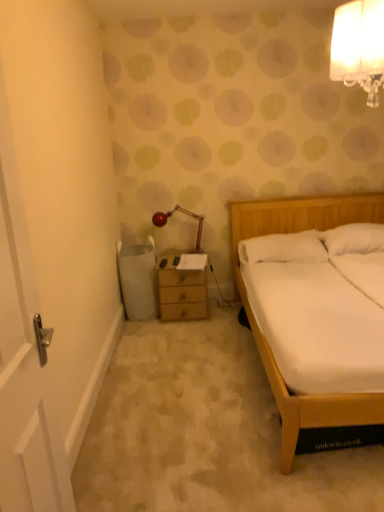
The height and width of the screenshot is (512, 384). Describe the element at coordinates (353, 238) in the screenshot. I see `white soft pillow at upper right, the 2th pillow when ordered from left to right` at that location.

What is the approximate height of white glass lampshade at upper right, which is counted as the 2th lamp, starting from the bottom?

white glass lampshade at upper right, which is counted as the 2th lamp, starting from the bottom, is 49.94 centimeters tall.

The image size is (384, 512). What are the coordinates of `white wooden door at left` in the screenshot? It's located at (52, 245).

Identify the location of wooden chest of drawers at center. This screenshot has width=384, height=512. (180, 289).

Where is `white soft pillow at upper right, arranged as the 1th pillow when viewed from the right`? This screenshot has width=384, height=512. white soft pillow at upper right, arranged as the 1th pillow when viewed from the right is located at coordinates (353, 238).

How many degrees apart are the facing directions of metallic red lamp at upper center, which is counted as the 1th lamp, starting from the back, and wooden chest of drawers at center?

A: They differ by 12.9 degrees in their facing directions.

How far apart are metallic red lamp at upper center, which is counted as the 1th lamp, starting from the back, and wooden chest of drawers at center?

metallic red lamp at upper center, which is counted as the 1th lamp, starting from the back, is 45.08 centimeters away from wooden chest of drawers at center.

Considering the sizes of objects metallic red lamp at upper center, which is counted as the 2th lamp, starting from the right, and wooden chest of drawers at center in the image provided, who is thinner, metallic red lamp at upper center, which is counted as the 2th lamp, starting from the right, or wooden chest of drawers at center?

With smaller width is metallic red lamp at upper center, which is counted as the 2th lamp, starting from the right.

From the image's perspective, between metallic red lamp at upper center, which ranks as the second lamp in front-to-back order, and wooden chest of drawers at center, which one is located above?

From the image's view, metallic red lamp at upper center, which ranks as the second lamp in front-to-back order, is above.

Does white soft pillow at right, which ranks as the second pillow in right-to-left order, have a greater height compared to wooden chest of drawers at center?

In fact, white soft pillow at right, which ranks as the second pillow in right-to-left order, may be shorter than wooden chest of drawers at center.

Is white soft pillow at right, which ranks as the second pillow in right-to-left order, oriented towards wooden chest of drawers at center?

No, white soft pillow at right, which ranks as the second pillow in right-to-left order, is not oriented towards wooden chest of drawers at center.

How distant is white soft pillow at right, marked as the 1th pillow in a left-to-right arrangement, from wooden chest of drawers at center?

A distance of 60.89 centimeters exists between white soft pillow at right, marked as the 1th pillow in a left-to-right arrangement, and wooden chest of drawers at center.

Is white soft pillow at right, which ranks as the second pillow in right-to-left order, thinner than wooden chest of drawers at center?

No.

From a real-world perspective, is white soft pillow at upper right, arranged as the 1th pillow when viewed from the right, located higher than wooden chest of drawers at center?

Yes, from a real-world perspective, white soft pillow at upper right, arranged as the 1th pillow when viewed from the right, is on top of wooden chest of drawers at center.

Are white soft pillow at upper right, the 2th pillow when ordered from left to right, and wooden chest of drawers at center far apart?

Indeed, white soft pillow at upper right, the 2th pillow when ordered from left to right, is not near wooden chest of drawers at center.

Between white soft pillow at upper right, the 2th pillow when ordered from left to right, and wooden chest of drawers at center, which one has smaller width?

With smaller width is white soft pillow at upper right, the 2th pillow when ordered from left to right.

Is white soft pillow at upper right, arranged as the 1th pillow when viewed from the right, to the left of wooden chest of drawers at center from the viewer's perspective?

Incorrect, white soft pillow at upper right, arranged as the 1th pillow when viewed from the right, is not on the left side of wooden chest of drawers at center.

From a real-world perspective, does white glass lampshade at upper right, acting as the 2th lamp starting from the left, sit lower than white plastic trash bin at left?

Incorrect, from a real-world perspective, white glass lampshade at upper right, acting as the 2th lamp starting from the left, is higher than white plastic trash bin at left.

Is white glass lampshade at upper right, acting as the 2th lamp starting from the left, smaller than white plastic trash bin at left?

Indeed, white glass lampshade at upper right, acting as the 2th lamp starting from the left, has a smaller size compared to white plastic trash bin at left.

Which of these two, white glass lampshade at upper right, marked as the second lamp in a back-to-front arrangement, or white plastic trash bin at left, stands taller?

With more height is white plastic trash bin at left.

In the scene shown: Is white soft pillow at right, which ranks as the second pillow in right-to-left order, spatially inside white plastic trash bin at left, or outside of it?

white soft pillow at right, which ranks as the second pillow in right-to-left order, is not enclosed by white plastic trash bin at left.

Could you measure the distance between white soft pillow at right, which ranks as the second pillow in right-to-left order, and white plastic trash bin at left?

37.05 inches.

From a real-world perspective, which object rests below the other?

In real-world perspective, white plastic trash bin at left is lower.

Considering the relative positions of white soft pillow at right, marked as the 1th pillow in a left-to-right arrangement, and white plastic trash bin at left in the image provided, is white soft pillow at right, marked as the 1th pillow in a left-to-right arrangement, to the left or to the right of white plastic trash bin at left?

Based on their positions, white soft pillow at right, marked as the 1th pillow in a left-to-right arrangement, is located to the right of white plastic trash bin at left.

Looking at this image, from the image's perspective, is wooden chest of drawers at center above or below white plastic trash bin at left?

Clearly, from the image's perspective, wooden chest of drawers at center is below white plastic trash bin at left.

Which of these two, wooden chest of drawers at center or white plastic trash bin at left, is bigger?

white plastic trash bin at left.

Which object is further away from the camera, wooden chest of drawers at center or white plastic trash bin at left?

wooden chest of drawers at center is further away from the camera.

Is the depth of white wooden door at left less than that of white plastic trash bin at left?

Answer: Yes, it is.

How far apart are white wooden door at left and white plastic trash bin at left?

The distance of white wooden door at left from white plastic trash bin at left is 1.04 meters.

Looking at this image, from the image's perspective, is white wooden door at left located beneath white plastic trash bin at left?

Yes, from the image's perspective, white wooden door at left is beneath white plastic trash bin at left.

From the picture: From a real-world perspective, who is located lower, white wooden door at left or white plastic trash bin at left?

In real-world perspective, white plastic trash bin at left is lower.

In order to click on chest of drawers below the metallic red lamp at upper center, which appears as the 1th lamp when viewed from the left (from a real-world perspective) in this screenshot , I will do `click(180, 289)`.

Image resolution: width=384 pixels, height=512 pixels. Find the location of `the chest of drawers located behind the white soft pillow at right, which ranks as the second pillow in right-to-left order`. the chest of drawers located behind the white soft pillow at right, which ranks as the second pillow in right-to-left order is located at coordinates (180, 289).

Based on the photo, which object lies further to the anchor point metallic red lamp at upper center, which ranks as the 1th lamp in bottom-to-top order, white wooden door at left or white soft pillow at upper right, the 2th pillow when ordered from left to right?

Among the two, white wooden door at left is located further to metallic red lamp at upper center, which ranks as the 1th lamp in bottom-to-top order.

Estimate the real-world distances between objects in this image. Which object is closer to white glass lampshade at upper right, acting as the 2th lamp starting from the left, white soft pillow at right, which ranks as the second pillow in right-to-left order, or white soft pillow at upper right, arranged as the 1th pillow when viewed from the right?

white soft pillow at right, which ranks as the second pillow in right-to-left order, lies closer to white glass lampshade at upper right, acting as the 2th lamp starting from the left, than the other object.

From the image, which object appears to be farther from metallic red lamp at upper center, which is counted as the 1th lamp, starting from the back, wooden chest of drawers at center or white plastic trash bin at left?

white plastic trash bin at left lies further to metallic red lamp at upper center, which is counted as the 1th lamp, starting from the back, than the other object.

Looking at the image, which one is located closer to wooden chest of drawers at center, white wooden door at left or white soft pillow at upper right, the 2th pillow when ordered from left to right?

Based on the image, white wooden door at left appears to be nearer to wooden chest of drawers at center.

Estimate the real-world distances between objects in this image. Which object is closer to white glass lampshade at upper right, which is the 1th lamp from front to back, white wooden door at left or metallic red lamp at upper center, which appears as the 1th lamp when viewed from the left?

The object closer to white glass lampshade at upper right, which is the 1th lamp from front to back, is white wooden door at left.

Which object lies further to the anchor point white soft pillow at right, which ranks as the second pillow in right-to-left order, metallic red lamp at upper center, which ranks as the second lamp in front-to-back order, or white plastic trash bin at left?

Based on the image, white plastic trash bin at left appears to be further to white soft pillow at right, which ranks as the second pillow in right-to-left order.

From the image, which object appears to be nearer to metallic red lamp at upper center, which is the 2th lamp from top to bottom, white glass lampshade at upper right, which is the 1th lamp from front to back, or white wooden door at left?

white wooden door at left.

Looking at the image, which one is located further to white wooden door at left, metallic red lamp at upper center, which is counted as the 2th lamp, starting from the right, or white plastic trash bin at left?

metallic red lamp at upper center, which is counted as the 2th lamp, starting from the right, is further to white wooden door at left.

Where is `trash bin/can between white wooden door at left and wooden chest of drawers at center in the front-back direction`? This screenshot has height=512, width=384. trash bin/can between white wooden door at left and wooden chest of drawers at center in the front-back direction is located at coordinates (138, 280).

Where is `lamp located between white wooden door at left and metallic red lamp at upper center, which is counted as the 2th lamp, starting from the right, in the depth direction`? The width and height of the screenshot is (384, 512). lamp located between white wooden door at left and metallic red lamp at upper center, which is counted as the 2th lamp, starting from the right, in the depth direction is located at coordinates (359, 46).

Locate an element on the screen. This screenshot has width=384, height=512. trash bin/can positioned between white glass lampshade at upper right, marked as the second lamp in a back-to-front arrangement, and wooden chest of drawers at center from near to far is located at coordinates (138, 280).

What are the coordinates of `chest of drawers between metallic red lamp at upper center, which is counted as the 2th lamp, starting from the right, and white soft pillow at right, which ranks as the second pillow in right-to-left order, in the horizontal direction` in the screenshot? It's located at (180, 289).